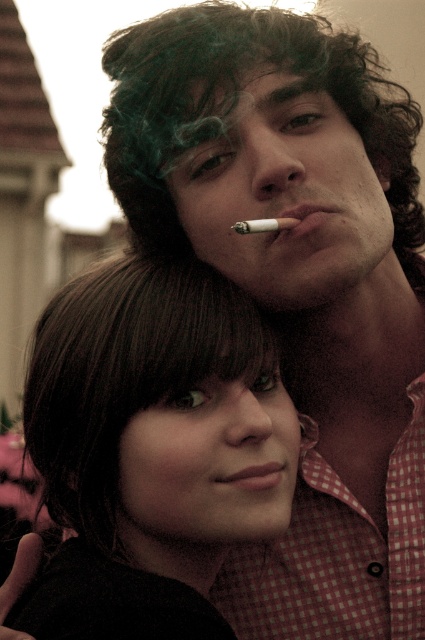
Question: Among these points, which one is farthest from the camera?

Choices:
 (A) (44, 589)
 (B) (118, 99)
 (C) (263, 221)
 (D) (285, 225)

Answer: (B)

Question: Can you confirm if green curly wig at upper center is smaller than matte cigarette at center?

Choices:
 (A) no
 (B) yes

Answer: (A)

Question: Can you confirm if matte pink lips at center is bigger than white matte cigarette at upper center?

Choices:
 (A) no
 (B) yes

Answer: (B)

Question: Which is farther from the white matte cigarette at upper center?

Choices:
 (A) smooth dark hair at center
 (B) matte cigarette at center
 (C) matte pink lips at center

Answer: (C)

Question: Among these objects, which one is nearest to the camera?

Choices:
 (A) matte pink lips at center
 (B) green curly wig at upper center

Answer: (A)

Question: Can you confirm if smooth dark hair at center is positioned above white matte cigarette at upper center?

Choices:
 (A) no
 (B) yes

Answer: (A)